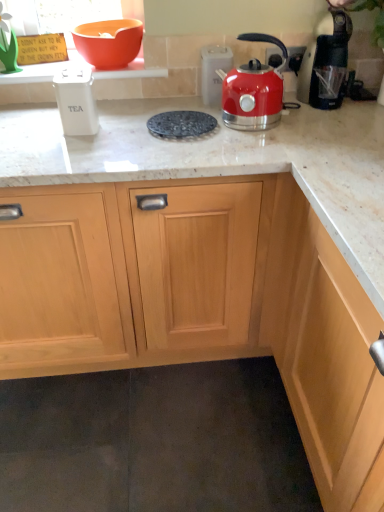
The width and height of the screenshot is (384, 512). Describe the element at coordinates (223, 162) in the screenshot. I see `white marble countertop at center` at that location.

Describe the element at coordinates (295, 58) in the screenshot. I see `metallic silver outlet at upper right` at that location.

The height and width of the screenshot is (512, 384). What do you see at coordinates (109, 42) in the screenshot?
I see `orange matte bowl at upper left` at bounding box center [109, 42].

Locate an element on the screen. Image resolution: width=384 pixels, height=512 pixels. black plastic coffee maker at upper right, the fourth kitchen appliance in the left-to-right sequence is located at coordinates (326, 62).

Identify the location of white plastic tea container at left, which appears as the 4th kitchen appliance when viewed from the right. (76, 100).

Find the location of a particular element. The height and width of the screenshot is (512, 384). kitchen appliance that is the 2nd one below the black plastic coffee maker at upper right, arranged as the 1th kitchen appliance when viewed from the right (from a real-world perspective) is located at coordinates (76, 100).

From the image's perspective, which is above, white plastic tea container at left, the 1th kitchen appliance viewed from the left, or black plastic coffee maker at upper right, the fourth kitchen appliance in the left-to-right sequence?

black plastic coffee maker at upper right, the fourth kitchen appliance in the left-to-right sequence, appears higher in the image.

Considering the positions of objects white plastic tea container at left, the 1th kitchen appliance viewed from the left, and black plastic coffee maker at upper right, the fourth kitchen appliance in the left-to-right sequence, in the image provided, who is behind, white plastic tea container at left, the 1th kitchen appliance viewed from the left, or black plastic coffee maker at upper right, the fourth kitchen appliance in the left-to-right sequence,?

black plastic coffee maker at upper right, the fourth kitchen appliance in the left-to-right sequence.

Considering the relative sizes of white plastic tea container at left, the 1th kitchen appliance viewed from the left, and black plastic coffee maker at upper right, the fourth kitchen appliance in the left-to-right sequence, in the image provided, is white plastic tea container at left, the 1th kitchen appliance viewed from the left, smaller than black plastic coffee maker at upper right, the fourth kitchen appliance in the left-to-right sequence,?

Indeed, white plastic tea container at left, the 1th kitchen appliance viewed from the left, has a smaller size compared to black plastic coffee maker at upper right, the fourth kitchen appliance in the left-to-right sequence.

Can you confirm if white plastic tea container at left, which appears as the 4th kitchen appliance when viewed from the right, is thinner than metallic silver outlet at upper right?

No, white plastic tea container at left, which appears as the 4th kitchen appliance when viewed from the right, is not thinner than metallic silver outlet at upper right.

From the picture: How much distance is there between white plastic tea container at left, the 1th kitchen appliance viewed from the left, and metallic silver outlet at upper right?

white plastic tea container at left, the 1th kitchen appliance viewed from the left, and metallic silver outlet at upper right are 27.62 inches apart from each other.

Does point (65, 87) come closer to viewer compared to point (296, 75)?

Yes, it is.

Does white plastic tea container at left, the 1th kitchen appliance viewed from the left, contain metallic silver outlet at upper right?

Definitely not — metallic silver outlet at upper right is not inside white plastic tea container at left, the 1th kitchen appliance viewed from the left.

Is black textured trivet at center oriented towards shiny metallic kettle at upper right, the second kitchen appliance from the right?

A: No, black textured trivet at center is not turned towards shiny metallic kettle at upper right, the second kitchen appliance from the right.

From a real-world perspective, is black textured trivet at center positioned above or below shiny metallic kettle at upper right, the third kitchen appliance viewed from the left?

black textured trivet at center is below shiny metallic kettle at upper right, the third kitchen appliance viewed from the left.

Between black textured trivet at center and shiny metallic kettle at upper right, the second kitchen appliance from the right, which one has more height?

shiny metallic kettle at upper right, the second kitchen appliance from the right.

Considering the relative positions of black textured trivet at center and shiny metallic kettle at upper right, the second kitchen appliance from the right, in the image provided, is black textured trivet at center to the left of shiny metallic kettle at upper right, the second kitchen appliance from the right, from the viewer's perspective?

Yes.

From the image's perspective, relative to metallic silver outlet at upper right, is orange matte bowl at upper left above or below?

Based on their image positions, orange matte bowl at upper left is located above metallic silver outlet at upper right.

Does orange matte bowl at upper left have a greater height compared to metallic silver outlet at upper right?

No.

Is orange matte bowl at upper left positioned far away from metallic silver outlet at upper right?

No, orange matte bowl at upper left is not far away from metallic silver outlet at upper right.

From a real-world perspective, is orange matte bowl at upper left under metallic silver outlet at upper right?

No, from a real-world perspective, orange matte bowl at upper left is not beneath metallic silver outlet at upper right.

Is metallic silver outlet at upper right completely or partially outside of white marble countertop at center?

Yes.

Can you see metallic silver outlet at upper right touching white marble countertop at center?

metallic silver outlet at upper right and white marble countertop at center are not in contact.

Is metallic silver outlet at upper right looking in the opposite direction of white marble countertop at center?

→ metallic silver outlet at upper right does not have its back to white marble countertop at center.

From a real-world perspective, is shiny metallic kettle at upper right, the third kitchen appliance viewed from the left, physically located above or below metallic silver outlet at upper right?

Clearly, from a real-world perspective, shiny metallic kettle at upper right, the third kitchen appliance viewed from the left, is above metallic silver outlet at upper right.

From the image's perspective, which object appears higher, shiny metallic kettle at upper right, the third kitchen appliance viewed from the left, or metallic silver outlet at upper right?

metallic silver outlet at upper right, from the image's perspective.

Which object is further away from the camera taking this photo, shiny metallic kettle at upper right, the second kitchen appliance from the right, or metallic silver outlet at upper right?

metallic silver outlet at upper right is behind.

How far apart are black textured trivet at center and orange matte bowl at upper left?

black textured trivet at center is 13.72 inches away from orange matte bowl at upper left.

Are black textured trivet at center and orange matte bowl at upper left located far from each other?

black textured trivet at center is near orange matte bowl at upper left, not far away.

From the picture: From a real-world perspective, is black textured trivet at center on orange matte bowl at upper left?

No, from a real-world perspective, black textured trivet at center is not over orange matte bowl at upper left

Which is behind, point (210, 131) or point (78, 31)?

Positioned behind is point (78, 31).

Find the location of a particular element. The height and width of the screenshot is (512, 384). the 2nd kitchen appliance above the white plastic tea container at left, which appears as the 4th kitchen appliance when viewed from the right (from a real-world perspective) is located at coordinates click(x=326, y=62).

This screenshot has width=384, height=512. What are the coordinates of `electric outlet above the white plastic tea container at left, the 1th kitchen appliance viewed from the left (from the image's perspective)` in the screenshot? It's located at (295, 58).

Which object lies further to the anchor point white marble countertop at center, orange matte bowl at upper left or white plastic tea container at left, which appears as the 4th kitchen appliance when viewed from the right?

orange matte bowl at upper left is further to white marble countertop at center.

Which object lies further to the anchor point black textured trivet at center, white marble countertop at center or orange matte bowl at upper left?

Among the two, orange matte bowl at upper left is located further to black textured trivet at center.

When comparing their distances from orange matte bowl at upper left, does metallic silver kettle at upper right, acting as the third kitchen appliance starting from the right, or metallic silver outlet at upper right seem closer?

Based on the image, metallic silver kettle at upper right, acting as the third kitchen appliance starting from the right, appears to be nearer to orange matte bowl at upper left.

Estimate the real-world distances between objects in this image. Which object is further from black textured trivet at center, black plastic coffee maker at upper right, the fourth kitchen appliance in the left-to-right sequence, or metallic silver outlet at upper right?

black plastic coffee maker at upper right, the fourth kitchen appliance in the left-to-right sequence, lies further to black textured trivet at center than the other object.

Based on their spatial positions, is black textured trivet at center or black plastic coffee maker at upper right, arranged as the 1th kitchen appliance when viewed from the right, closer to metallic silver kettle at upper right, placed as the 2th kitchen appliance when sorted from left to right?

black textured trivet at center.

Based on their spatial positions, is white marble countertop at center or metallic silver kettle at upper right, placed as the 2th kitchen appliance when sorted from left to right, closer to white plastic tea container at left, which appears as the 4th kitchen appliance when viewed from the right?

Among the two, white marble countertop at center is located nearer to white plastic tea container at left, which appears as the 4th kitchen appliance when viewed from the right.

Considering their positions, is white marble countertop at center positioned closer to black plastic coffee maker at upper right, arranged as the 1th kitchen appliance when viewed from the right, than white plastic tea container at left, which appears as the 4th kitchen appliance when viewed from the right?

white marble countertop at center lies closer to black plastic coffee maker at upper right, arranged as the 1th kitchen appliance when viewed from the right, than the other object.

When comparing their distances from shiny metallic kettle at upper right, the second kitchen appliance from the right, does orange matte bowl at upper left or black textured trivet at center seem further?

Among the two, orange matte bowl at upper left is located further to shiny metallic kettle at upper right, the second kitchen appliance from the right.

Find the location of a particular element. This screenshot has height=512, width=384. gas stove situated between white plastic tea container at left, the 1th kitchen appliance viewed from the left, and metallic silver outlet at upper right from left to right is located at coordinates (181, 124).

You are a GUI agent. You are given a task and a screenshot of the screen. Output one action in this format:
    pyautogui.click(x=<x>, y=<y>)
    Task: Click on the kitchen appliance between shiny metallic kettle at upper right, the third kitchen appliance viewed from the left, and white marble countertop at center from top to bottom
    
    Given the screenshot: What is the action you would take?
    pyautogui.click(x=76, y=100)

At what (x,y) coordinates should I click in order to perform the action: click on kitchen appliance between white plastic tea container at left, the 1th kitchen appliance viewed from the left, and shiny metallic kettle at upper right, the third kitchen appliance viewed from the left, in the horizontal direction. Please return your answer as a coordinate pair (x, y). This screenshot has height=512, width=384. Looking at the image, I should click on (214, 72).

This screenshot has height=512, width=384. Identify the location of gas stove between metallic silver outlet at upper right and white marble countertop at center from top to bottom. coord(181,124).